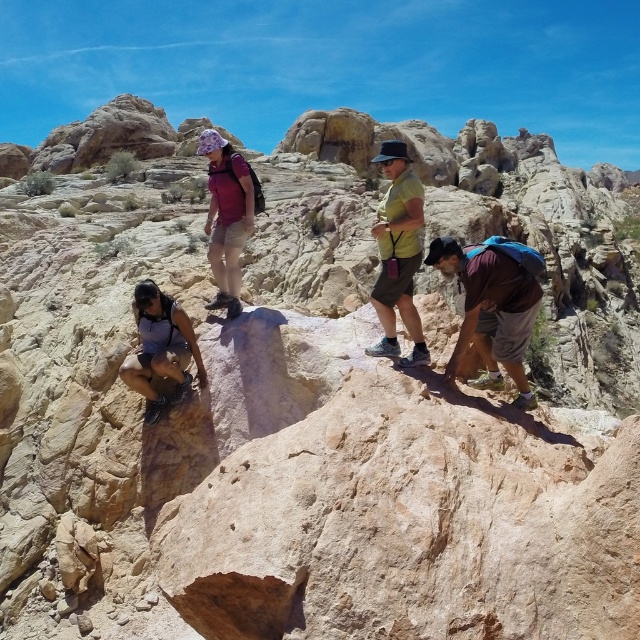
Question: Is maroon fabric shirt at lower right thinner than green matte shorts at center?

Choices:
 (A) no
 (B) yes

Answer: (A)

Question: Considering the real-world distances, which object is closest to the maroon fabric shirt at lower right?

Choices:
 (A) purple fabric shirt at center
 (B) green matte shorts at center

Answer: (B)

Question: Which of the following is the farthest from the observer?

Choices:
 (A) maroon fabric shirt at lower right
 (B) purple fabric shirt at center
 (C) green matte shorts at center

Answer: (B)

Question: Is green matte shorts at center positioned behind purple fabric shirt at center?

Choices:
 (A) no
 (B) yes

Answer: (A)

Question: Can you confirm if maroon fabric shirt at lower right is positioned to the right of green matte shorts at center?

Choices:
 (A) no
 (B) yes

Answer: (B)

Question: Estimate the real-world distances between objects in this image. Which object is closer to the green matte shorts at center?

Choices:
 (A) maroon fabric shirt at lower right
 (B) purple fabric shirt at center

Answer: (A)